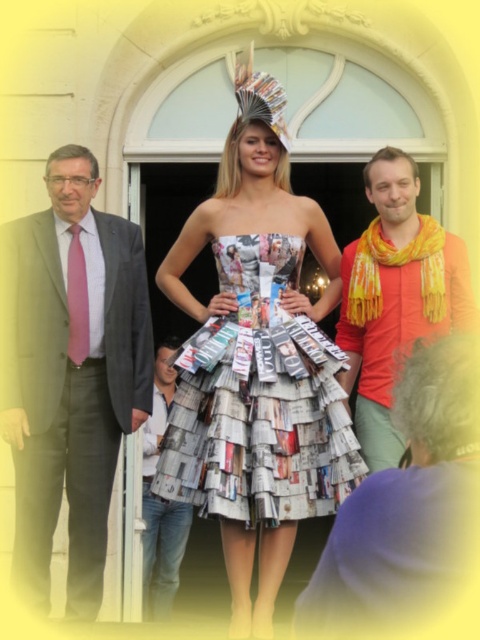
You are a photographer setting up a shoot in front of a classical building with an arched doorway. You have two models dressed in a printed newspaper dress at center and a white cotton shirt at center. Based on the scene, which model should you position closer to the doorway to ensure their outfit is clearly visible in the photo?

The printed newspaper dress at center should be positioned closer to the doorway because it might be wider than the white cotton shirt at center, making it more noticeable and easier to capture in the photo.

You are a photographer at the event and want to capture a photo that includes both the pink silk tie at left and the orange scarf at right. Based on their positions, which one should be placed lower in the frame to ensure both are visible?

The pink silk tie at left is located below the orange scarf at right, so to include both in the frame, the pink silk tie at left should be placed lower while the orange scarf at right remains higher.